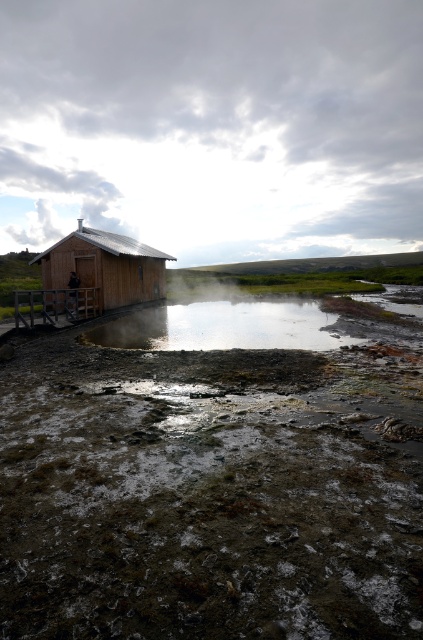
Question: Does muddy wet ground at lower left appear on the left side of wooden hut at left?

Choices:
 (A) no
 (B) yes

Answer: (A)

Question: Which of the following is the farthest from the observer?

Choices:
 (A) wooden hut at left
 (B) muddy wet ground at lower left
 (C) clear water at center

Answer: (A)

Question: Which point appears closest to the camera in this image?

Choices:
 (A) (115, 262)
 (B) (415, 552)
 (C) (332, 340)

Answer: (B)

Question: Which object appears farthest from the camera in this image?

Choices:
 (A) wooden hut at left
 (B) muddy wet ground at lower left
 (C) clear water at center

Answer: (A)

Question: Does clear water at center have a greater width compared to wooden hut at left?

Choices:
 (A) no
 (B) yes

Answer: (B)

Question: Is clear water at center below wooden hut at left?

Choices:
 (A) no
 (B) yes

Answer: (B)